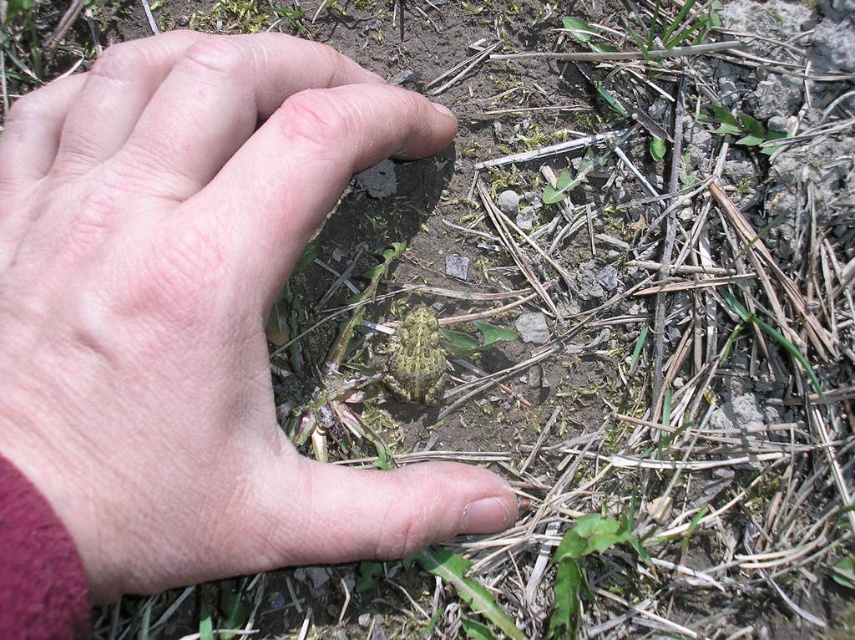
You are a biologist observing a frog in its natural habitat. You notice a pink flesh at center and a camouflage skin frog at center. Which object is taller?

The pink flesh at center is taller than the camouflage skin frog at center.